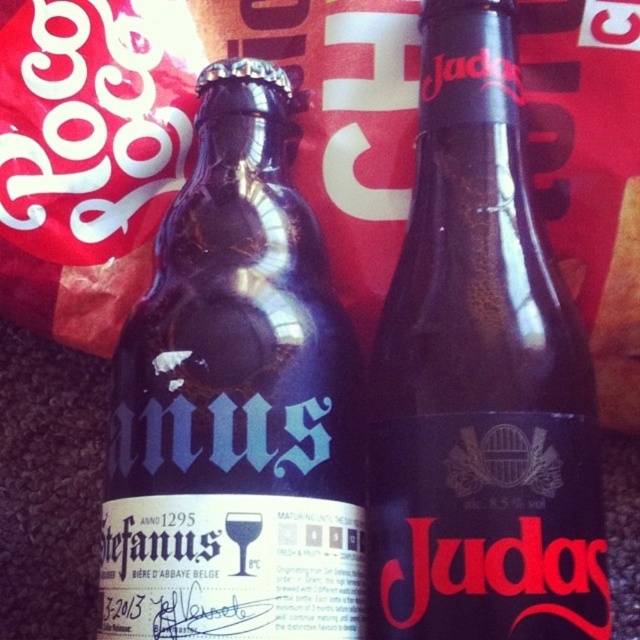
You are a store employee arranging bottles on a shelf. You have a blue glass bottle at left and a dark glass bottle at center. The shelf is 12 inches wide. If you want to place both bottles side by side without overlapping, will there be enough space?

The distance between the blue glass bottle at left and the dark glass bottle at center is 7.46 inches. Since the shelf is 12 inches wide, there is enough space to place both bottles side by side without overlapping as 7.46 inches is less than 12 inches.

Based on the photo, you are standing 1.15 meters away from the point at coordinates point (276,141) in the image. The scene shows two dark glass bottles against a red background. Can you tell me which bottle is closer to you?

The point (276,141) is exactly 1.15 meters away from you, so the bottle located at that point is closer to you than the other bottle.

You are a photographer adjusting your camera settings to focus on two points in the image. The first point is point [342,588] and the second is point [508,163]. Which point should you focus on first to ensure the closest object is sharp?

Point [342,588] is closer to the camera than point [508,163], so you should focus on point [342,588] first to ensure the closest object is sharp.